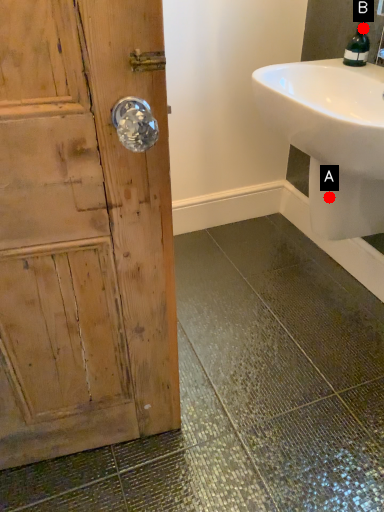
Question: Two points are circled on the image, labeled by A and B beside each circle. Among these points, which one is farthest from the camera?

Choices:
 (A) A is further
 (B) B is further

Answer: (B)